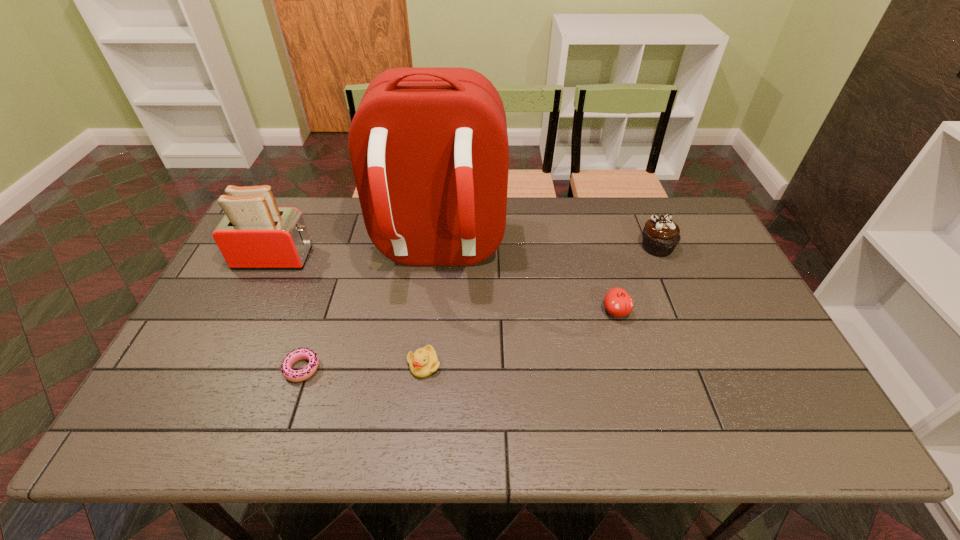
At what (x,y) coordinates should I click in order to perform the action: click on backpack. Please return your answer as a coordinate pair (x, y). This screenshot has height=540, width=960. Looking at the image, I should click on (428, 146).

The image size is (960, 540). I want to click on toaster, so click(x=255, y=233).

Find the location of a particular element. This screenshot has width=960, height=540. the second tallest object is located at coordinates (255, 233).

Locate an element on the screen. The height and width of the screenshot is (540, 960). the rightmost object is located at coordinates (661, 235).

Find the location of a particular element. cupcake is located at coordinates (661, 235).

What are the coordinates of `the second object from right to left` in the screenshot? It's located at (618, 303).

In order to click on apple in this screenshot , I will do `click(618, 303)`.

I want to click on the fifth tallest object, so click(x=423, y=362).

The width and height of the screenshot is (960, 540). What are the coordinates of `the shortest object` in the screenshot? It's located at (301, 353).

Locate an element on the screen. doughnut is located at coordinates (301, 353).